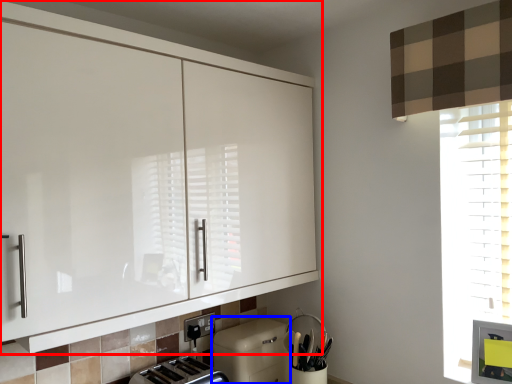
Question: Which object appears farthest to the camera in this image, cabinetry (highlighted by a red box) or dish washer (highlighted by a blue box)?

Choices:
 (A) cabinetry
 (B) dish washer

Answer: (B)